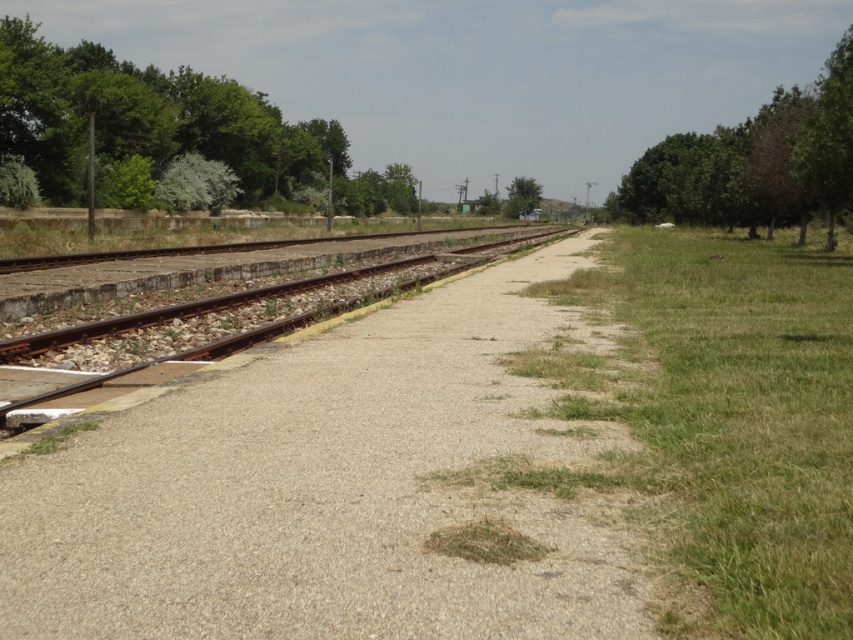
You are standing on the concrete platform and looking towards the tracks. Which of the two green leafy trees, the green leafy tree at left or the green leafy tree at upper right, appears higher in the scene?

The green leafy tree at left appears higher in the scene than the green leafy tree at upper right because it is positioned above it.

You are standing on the railway platform and want to determine which of the two points, point (82, 508) or point (16, 108), is nearer to you. Based on the scene, which point is closer?

Point (82, 508) is closer to the camera than point (16, 108), so it is the nearer one.